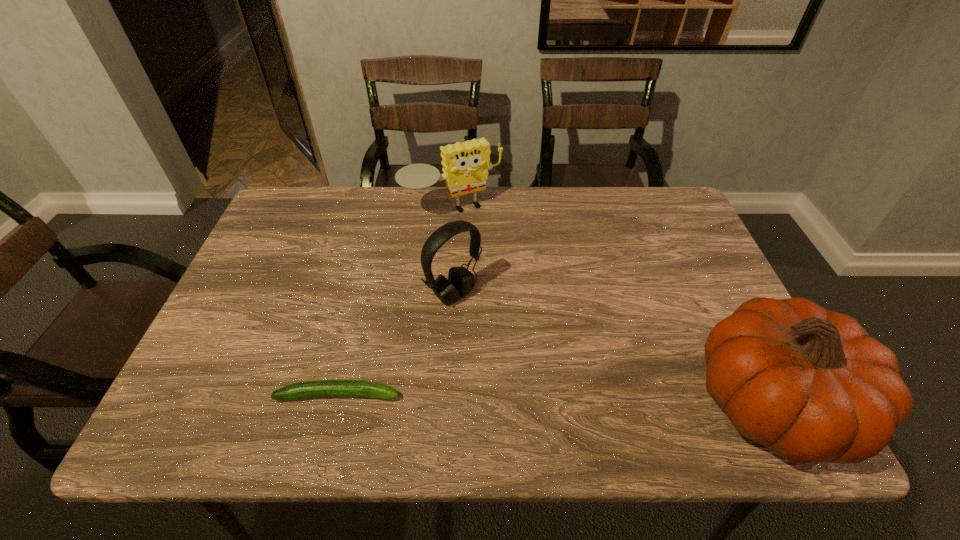
The width and height of the screenshot is (960, 540). Find the location of `vacant space at the far left corner of the desktop`. vacant space at the far left corner of the desktop is located at coordinates [x=300, y=200].

Identify the location of blank space at the near left corner of the desktop. Image resolution: width=960 pixels, height=540 pixels. (199, 367).

Identify the location of free region at the far right corner of the desktop. The width and height of the screenshot is (960, 540). (658, 218).

You are a GUI agent. You are given a task and a screenshot of the screen. Output one action in this format:
    pyautogui.click(x=<x>, y=<y>)
    Task: Click on the free spot between the second farthest object and the farthest object
    
    Given the screenshot: What is the action you would take?
    pyautogui.click(x=453, y=253)

In order to click on free space between the shortest object and the second farthest object in this screenshot , I will do `click(396, 345)`.

Locate an element on the screen. The image size is (960, 540). vacant point located between the shortest object and the rightmost object is located at coordinates (555, 399).

Where is `vacant space that is in between the headset and the shortest object`? This screenshot has height=540, width=960. vacant space that is in between the headset and the shortest object is located at coordinates (396, 345).

The width and height of the screenshot is (960, 540). I want to click on free area in between the sponge and the pumpkin, so click(x=612, y=308).

This screenshot has height=540, width=960. Find the location of `empty location between the zucchini and the headset`. empty location between the zucchini and the headset is located at coordinates (396, 345).

In order to click on vacant space that's between the pumpkin and the sponge in this screenshot , I will do `click(612, 308)`.